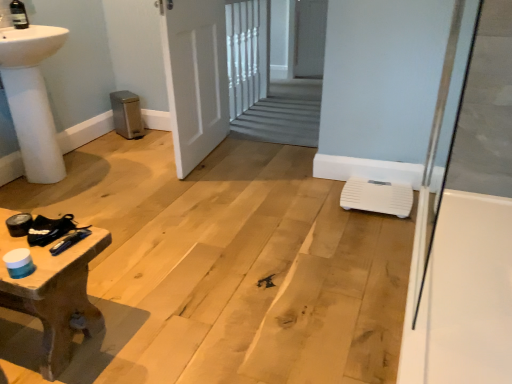
What are the coordinates of `free space to the left of white plastic scale at lower right` in the screenshot? It's located at (317, 198).